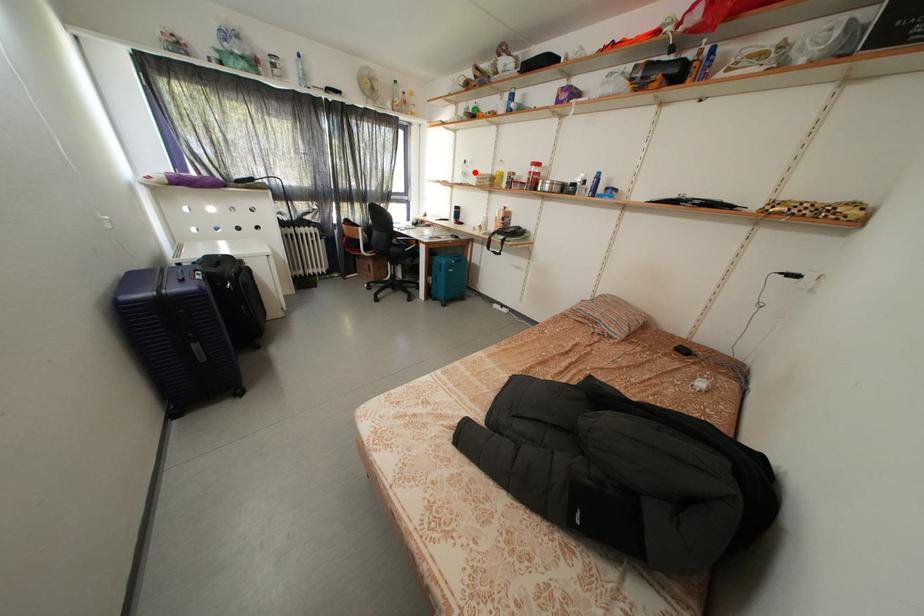
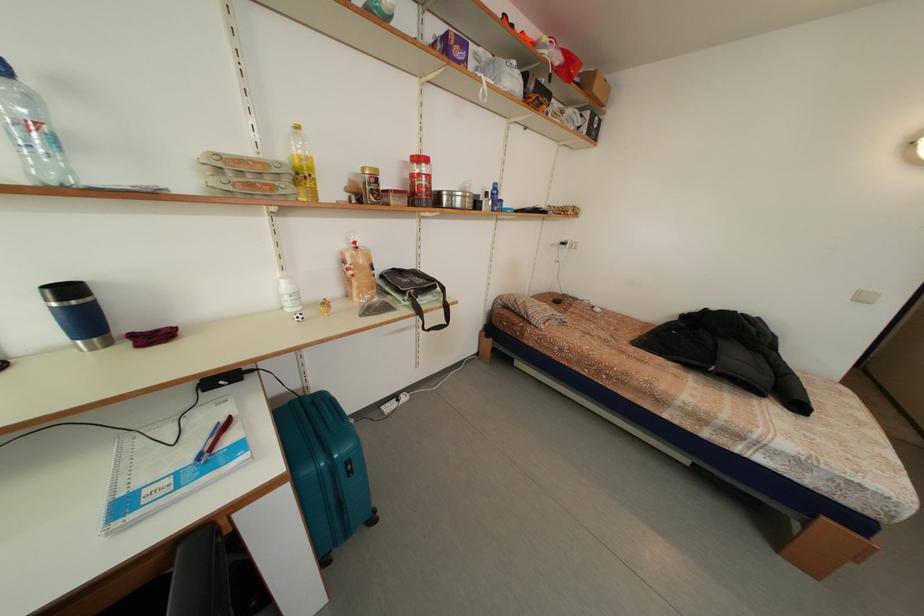
Question: I am providing you with two images of the same scene from different viewpoints. A red point is marked on the first image. Is the red point's position out of view in image 2?

Choices:
 (A) Yes
 (B) No

Answer: (B)